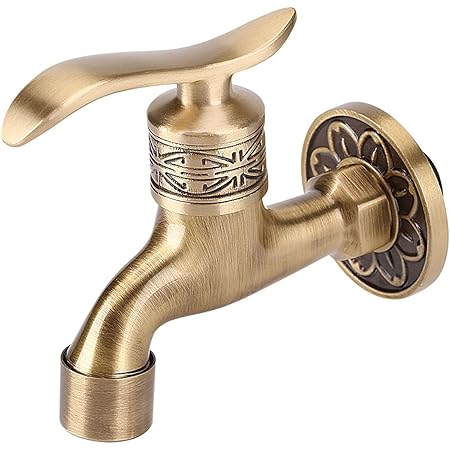
This screenshot has height=450, width=450. I want to click on brass facet, so click(190, 293).